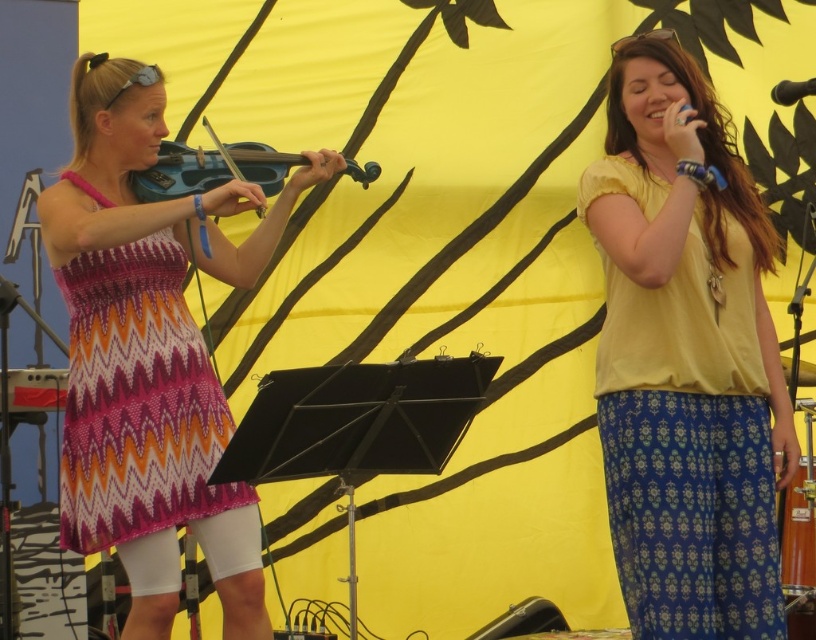
Is point (754, 196) closer to camera compared to point (102, 416)?

No, (754, 196) is further to viewer.

Which is above, yellow cotton shirt at upper right or pink zigzag knit dress at left?

yellow cotton shirt at upper right

Is point (693, 358) positioned before point (175, 408)?

Yes, point (693, 358) is closer to viewer.

Where is `yellow cotton shirt at upper right`? yellow cotton shirt at upper right is located at coordinates (686, 358).

What do you see at coordinates (136, 401) in the screenshot? I see `pink zigzag knit dress at left` at bounding box center [136, 401].

Is pink zigzag knit dress at left bigger than black plastic microphone at upper right?

Yes.

What do you see at coordinates (136, 401) in the screenshot? I see `pink zigzag knit dress at left` at bounding box center [136, 401].

Locate an element on the screen. pink zigzag knit dress at left is located at coordinates (136, 401).

Does point (739, 618) come farther from viewer compared to point (145, 176)?

No, (739, 618) is closer to viewer.

Does yellow cotton shirt at upper right have a greater height compared to matte blue violin at left?

Yes, yellow cotton shirt at upper right is taller than matte blue violin at left.

At what (x,y) coordinates should I click in order to perform the action: click on yellow cotton shirt at upper right. Please return your answer as a coordinate pair (x, y). Looking at the image, I should click on (686, 358).

This screenshot has width=816, height=640. Identify the location of yellow cotton shirt at upper right. (686, 358).